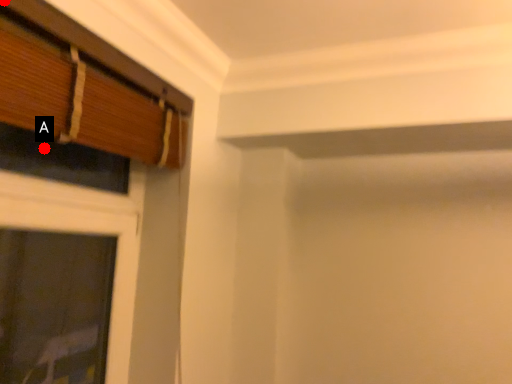
Question: Two points are circled on the image, labeled by A and B beside each circle. Which point is closer to the camera?

Choices:
 (A) A is closer
 (B) B is closer

Answer: (B)